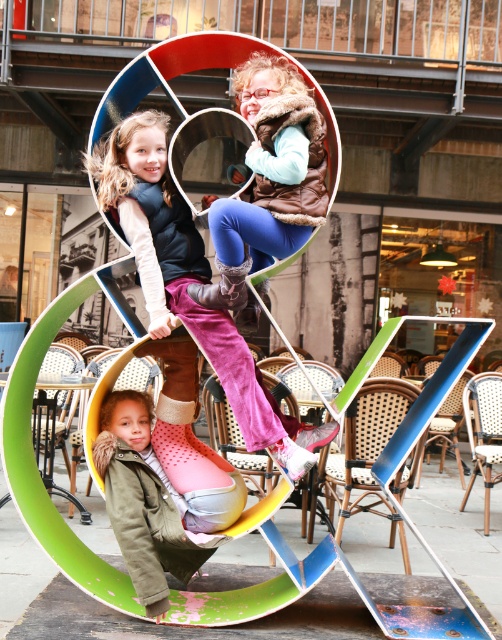
Is velvet pink pants at center taller than velvet blue pants at center?

Yes.

Between point (232, 346) and point (292, 179), which one is positioned in front?

Point (292, 179)

At what (x,y) coordinates should I click in order to perform the action: click on velvet pink pants at center. Please return your answer as a coordinate pair (x, y). This screenshot has width=502, height=640. Looking at the image, I should click on (185, 275).